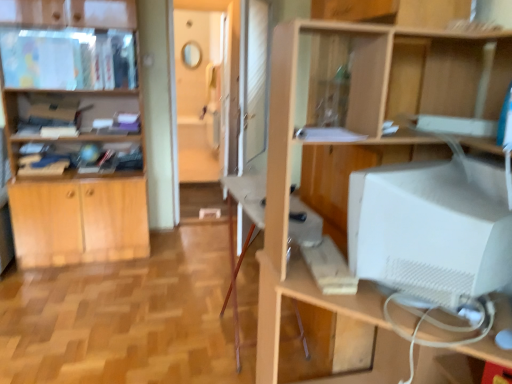
Question: Can you confirm if matte wooden cabinet at upper left is wider than light wood cabinet at left?

Choices:
 (A) yes
 (B) no

Answer: (B)

Question: Could light wood cabinet at left be considered to be inside matte wooden cabinet at upper left?

Choices:
 (A) no
 (B) yes

Answer: (A)

Question: Does matte wooden cabinet at upper left appear on the left side of light wood cabinet at left?

Choices:
 (A) no
 (B) yes

Answer: (B)

Question: From a real-world perspective, is matte wooden cabinet at upper left over light wood cabinet at left?

Choices:
 (A) yes
 (B) no

Answer: (A)

Question: Is the position of matte wooden cabinet at upper left less distant than that of light wood cabinet at left?

Choices:
 (A) no
 (B) yes

Answer: (A)

Question: From the image's perspective, relative to white matte computer monitor at right, is matte wooden cabinet at upper left above or below?

Choices:
 (A) below
 (B) above

Answer: (B)

Question: From a real-world perspective, relative to white matte computer monitor at right, is matte wooden cabinet at upper left vertically above or below?

Choices:
 (A) below
 (B) above

Answer: (B)

Question: Is matte wooden cabinet at upper left situated inside white matte computer monitor at right or outside?

Choices:
 (A) inside
 (B) outside

Answer: (B)

Question: In terms of size, does matte wooden cabinet at upper left appear bigger or smaller than white matte computer monitor at right?

Choices:
 (A) small
 (B) big

Answer: (A)

Question: From the image's perspective, relative to matte wooden cabinet at upper left, is white matte computer monitor at right above or below?

Choices:
 (A) below
 (B) above

Answer: (A)

Question: Looking at their shapes, would you say white matte computer monitor at right is wider or thinner than matte wooden cabinet at upper left?

Choices:
 (A) wide
 (B) thin

Answer: (A)

Question: Relative to matte wooden cabinet at upper left, is white matte computer monitor at right in front or behind?

Choices:
 (A) behind
 (B) front

Answer: (B)

Question: Is white matte computer monitor at right inside or outside of matte wooden cabinet at upper left?

Choices:
 (A) inside
 (B) outside

Answer: (B)

Question: Considering the positions of point (96, 46) and point (230, 175), is point (96, 46) closer or farther from the camera than point (230, 175)?

Choices:
 (A) farther
 (B) closer

Answer: (A)

Question: From the image's perspective, is matte wooden cabinet at upper left above or below wooden computer desk at center?

Choices:
 (A) above
 (B) below

Answer: (A)